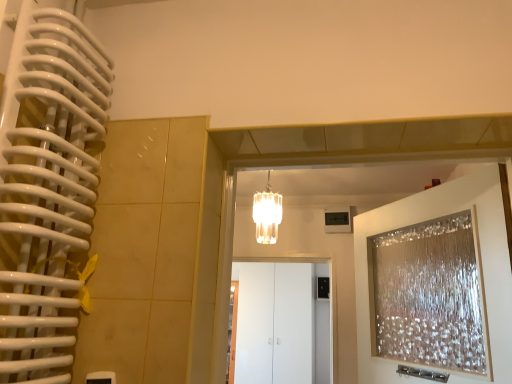
At what (x,y) coordinates should I click in order to perform the action: click on white glossy cabinet at center. Please return your answer as a coordinate pair (x, y). The image size is (512, 384). Looking at the image, I should click on (275, 323).

What do you see at coordinates (267, 214) in the screenshot?
I see `translucent glass chandelier at center` at bounding box center [267, 214].

Identify the location of white glossy cabinet at center. The width and height of the screenshot is (512, 384). (275, 323).

Based on the photo, considering the relative positions of translucent glass chandelier at center and white glossy cabinet at center in the image provided, is translucent glass chandelier at center to the right of white glossy cabinet at center from the viewer's perspective?

No.

What's the angular difference between translucent glass chandelier at center and white glossy cabinet at center's facing directions?

4.49 degrees.

The height and width of the screenshot is (384, 512). In order to click on glass door that appears behind the translucent glass chandelier at center in this screenshot , I will do `click(275, 323)`.

Could you tell me if translucent glass chandelier at center is facing white glossy cabinet at center?

No, translucent glass chandelier at center is not oriented towards white glossy cabinet at center.

Are translucent glass door at upper right and translucent glass chandelier at center making contact?

translucent glass door at upper right is not next to translucent glass chandelier at center, and they're not touching.

Is point (482, 220) positioned before point (253, 197)?

Yes.

Which of these two, translucent glass door at upper right or translucent glass chandelier at center, is wider?

translucent glass chandelier at center is wider.

How different are the orientations of translucent glass door at upper right and translucent glass chandelier at center in degrees?

57.2 degrees.

From the picture: Which of these two, translucent glass door at upper right or white glossy cabinet at center, stands taller?

With more height is white glossy cabinet at center.

From the image's perspective, is translucent glass door at upper right located above or below white glossy cabinet at center?

From the image's perspective, translucent glass door at upper right appears above white glossy cabinet at center.

Is translucent glass door at upper right next to white glossy cabinet at center and touching it?

translucent glass door at upper right and white glossy cabinet at center are clearly separated.

Is translucent glass door at upper right positioned beyond the bounds of white glossy cabinet at center?

Yes.

Would you say translucent glass chandelier at center is inside or outside translucent glass door at upper right?

translucent glass chandelier at center exists outside the volume of translucent glass door at upper right.

Find the location of a particular element. The width and height of the screenshot is (512, 384). lamp on the left side of translucent glass door at upper right is located at coordinates click(267, 214).

Based on the photo, which of these two, translucent glass chandelier at center or translucent glass door at upper right, is smaller?

translucent glass chandelier at center is smaller.

From a real-world perspective, which is physically above, translucent glass chandelier at center or translucent glass door at upper right?

translucent glass chandelier at center is physically above.

Is white glossy cabinet at center not close to translucent glass chandelier at center?

Yes, white glossy cabinet at center and translucent glass chandelier at center are located far from each other.

Looking at this image, from the image's perspective, is white glossy cabinet at center above or below translucent glass chandelier at center?

Based on their image positions, white glossy cabinet at center is located beneath translucent glass chandelier at center.

Would you say white glossy cabinet at center is inside or outside translucent glass chandelier at center?

white glossy cabinet at center is not inside translucent glass chandelier at center, it's outside.

This screenshot has height=384, width=512. I want to click on lamp above the white glossy cabinet at center (from the image's perspective), so click(x=267, y=214).

Is white glossy cabinet at center located outside translucent glass door at upper right?

Yes, white glossy cabinet at center is not within translucent glass door at upper right.

Does white glossy cabinet at center have a greater width compared to translucent glass door at upper right?

No, white glossy cabinet at center is not wider than translucent glass door at upper right.

Identify the location of door that appears above the white glossy cabinet at center (from the image's perspective). The width and height of the screenshot is (512, 384). (482, 262).

From the picture: From a real-world perspective, is white glossy cabinet at center located higher than translucent glass door at upper right?

Incorrect, from a real-world perspective, white glossy cabinet at center is lower than translucent glass door at upper right.

Locate an element on the screen. lamp in front of the white glossy cabinet at center is located at coordinates (267, 214).

Find the location of a particular element. This screenshot has width=512, height=384. lamp that is on the left side of translucent glass door at upper right is located at coordinates (267, 214).

When comparing their distances from translucent glass chandelier at center, does translucent glass door at upper right or white glossy cabinet at center seem closer?

translucent glass door at upper right lies closer to translucent glass chandelier at center than the other object.

Looking at the image, which one is located closer to white glossy cabinet at center, translucent glass chandelier at center or translucent glass door at upper right?

translucent glass chandelier at center lies closer to white glossy cabinet at center than the other object.

Estimate the real-world distances between objects in this image. Which object is further from translucent glass door at upper right, translucent glass chandelier at center or white glossy cabinet at center?

The object further to translucent glass door at upper right is white glossy cabinet at center.

Considering their positions, is translucent glass door at upper right positioned closer to white glossy cabinet at center than translucent glass chandelier at center?

translucent glass chandelier at center.

From the image, which object appears to be farther from translucent glass chandelier at center, white glossy cabinet at center or translucent glass door at upper right?

Based on the image, white glossy cabinet at center appears to be further to translucent glass chandelier at center.

Considering their positions, is white glossy cabinet at center positioned closer to translucent glass door at upper right than translucent glass chandelier at center?

translucent glass chandelier at center is positioned closer to the anchor translucent glass door at upper right.

This screenshot has width=512, height=384. In order to click on lamp located between translucent glass door at upper right and white glossy cabinet at center in the depth direction in this screenshot , I will do [x=267, y=214].